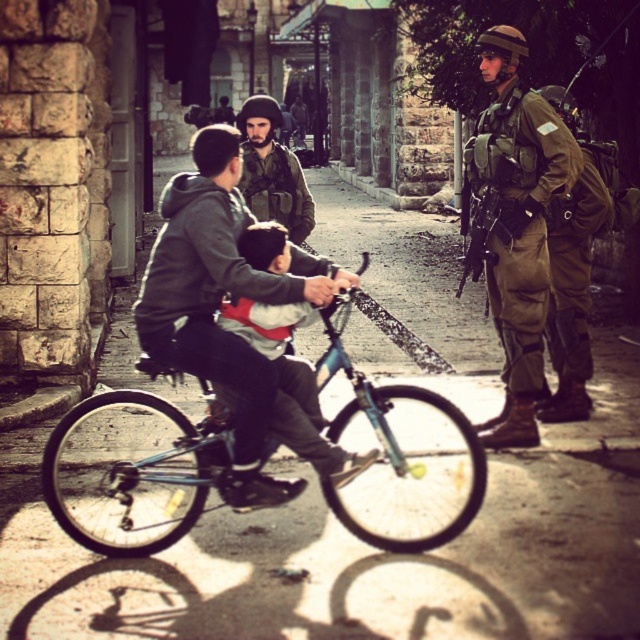
Is teal matte bicycle at center thinner than light blue plastic bicycle at center?

In fact, teal matte bicycle at center might be wider than light blue plastic bicycle at center.

Is point (426, 548) more distant than point (164, 280)?

No, it is not.

Who is more forward, [170,371] or [220,273]?

Positioned in front is point [220,273].

Image resolution: width=640 pixels, height=640 pixels. What are the coordinates of `teal matte bicycle at center` in the screenshot? It's located at (131, 472).

Image resolution: width=640 pixels, height=640 pixels. Identify the location of matte blue bicycle at center. (292, 385).

Between matte blue bicycle at center and camouflage uniform at center, which one appears on the right side from the viewer's perspective?

Positioned to the right is matte blue bicycle at center.

Image resolution: width=640 pixels, height=640 pixels. I want to click on matte blue bicycle at center, so click(x=292, y=385).

Identify the location of matte blue bicycle at center. The image size is (640, 640). (292, 385).

Does teal matte bicycle at center lie in front of matte blue bicycle at center?

No, teal matte bicycle at center is further to the viewer.

Is point (48, 458) less distant than point (269, 228)?

Yes.

Identify the location of teal matte bicycle at center. (131, 472).